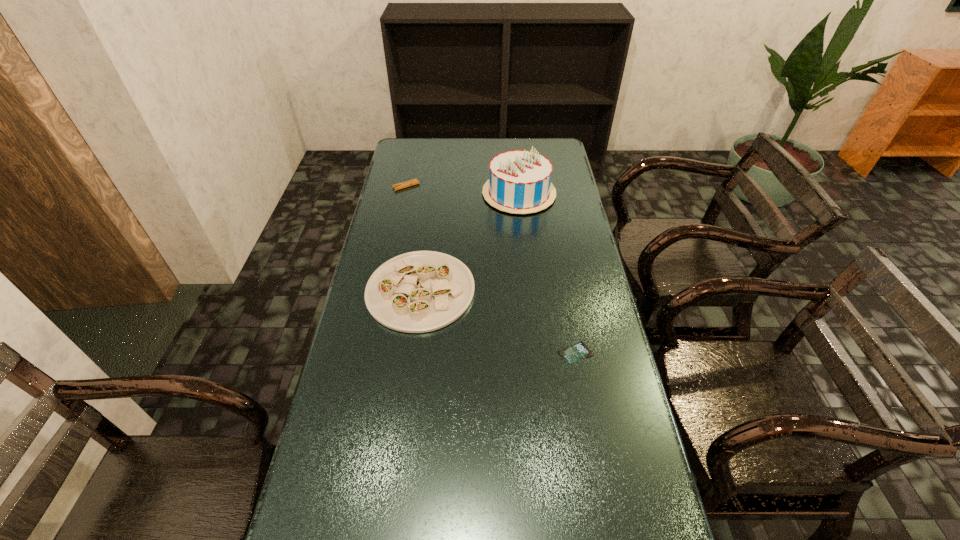
Find the location of a particular element. free point between the platter and the birthday cake is located at coordinates (469, 242).

Locate an element on the screen. The width and height of the screenshot is (960, 540). vacant space in between the third shortest object and the birthday cake is located at coordinates (469, 242).

At what (x,y) coordinates should I click in order to perform the action: click on free area in between the tallest object and the identity card. Please return your answer as a coordinate pair (x, y). This screenshot has width=960, height=540. Looking at the image, I should click on (547, 273).

This screenshot has height=540, width=960. I want to click on vacant space in between the second shortest object and the identity card, so click(491, 269).

Identify the location of free spot between the birthday cake and the platter. This screenshot has width=960, height=540. (469, 242).

Locate an element on the screen. The image size is (960, 540). vacant point located between the nearest object and the second tallest object is located at coordinates (498, 321).

Locate an element on the screen. Image resolution: width=960 pixels, height=540 pixels. object that stands as the closest to the third tallest object is located at coordinates (519, 182).

Identify which object is located as the third nearest to the identity card. Please provide its 2D coordinates. Your answer should be formatted as a tuple, i.e. [(x, y)], where the tuple contains the x and y coordinates of a point satisfying the conditions above.

[(405, 184)]

In order to click on free spot that satisfies the following two spatial constraints: 1. on the front side of the third tallest object; 2. on the left side of the second tallest object in this screenshot , I will do `click(384, 291)`.